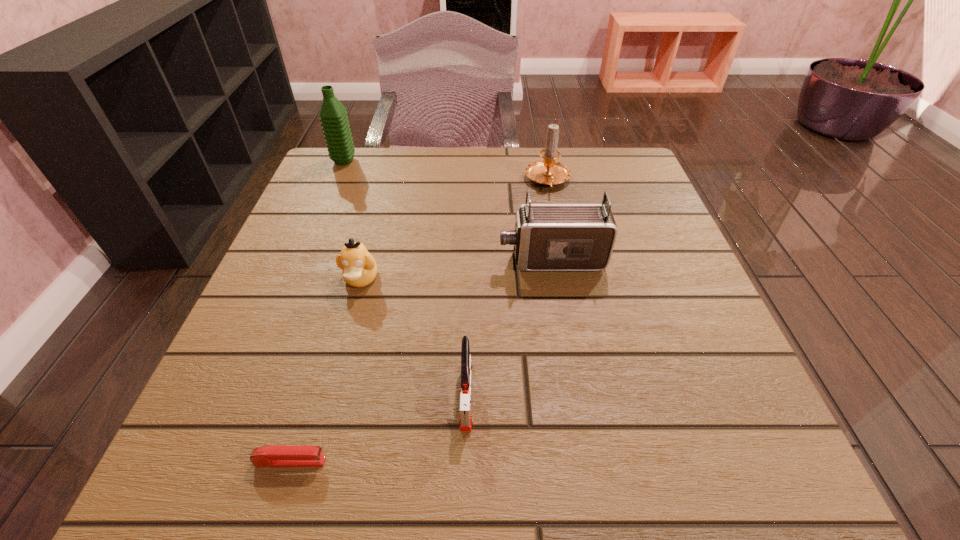
At what (x,y) coordinates should I click in order to perform the action: click on free point between the leftmost object and the shortest object. Please return your answer as a coordinate pair (x, y). This screenshot has width=960, height=540. Looking at the image, I should click on (317, 311).

Find the location of a particular element. The width and height of the screenshot is (960, 540). object that stands as the second closest to the camcorder is located at coordinates (465, 416).

Identify which object is the second closest to the fifth farthest object. Please provide its 2D coordinates. Your answer should be formatted as a tuple, i.e. [(x, y)], where the tuple contains the x and y coordinates of a point satisfying the conditions above.

[(547, 237)]

Where is `free space that satisfies the following two spatial constraints: 1. on the face of the duckling; 2. on the front-facing side of the shortest object`? free space that satisfies the following two spatial constraints: 1. on the face of the duckling; 2. on the front-facing side of the shortest object is located at coordinates (312, 461).

Locate an element on the screen. The height and width of the screenshot is (540, 960). vacant space that satisfies the following two spatial constraints: 1. at the lens of the camcorder; 2. on the face of the duckling is located at coordinates (555, 279).

Where is `vacant space that satisfies the following two spatial constraints: 1. at the lens of the camcorder; 2. on the handle side of the taller stapler`? vacant space that satisfies the following two spatial constraints: 1. at the lens of the camcorder; 2. on the handle side of the taller stapler is located at coordinates (575, 395).

You are a GUI agent. You are given a task and a screenshot of the screen. Output one action in this format:
    pyautogui.click(x=<x>, y=<y>)
    Task: Click on the blank area in the image that satisfies the following two spatial constraints: 1. on the face of the duckling; 2. on the front-facing side of the shortest object
    This screenshot has width=960, height=540.
    Given the screenshot: What is the action you would take?
    [312, 461]